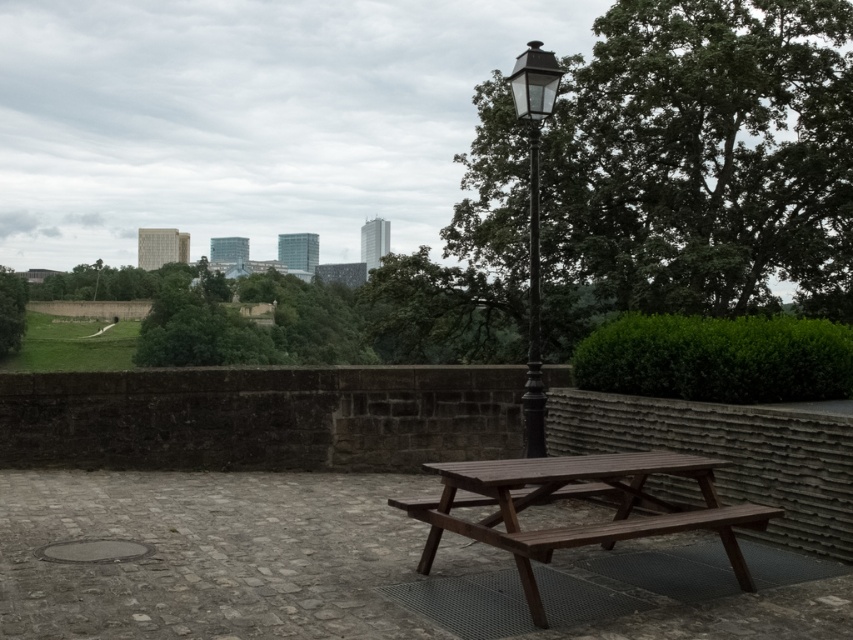
Between brown wooden table at center and black metal lamp post at center, which one is positioned lower?

brown wooden table at center is lower down.

Does brown wooden table at center lie in front of black metal lamp post at center?

Yes, it is in front of black metal lamp post at center.

You are a GUI agent. You are given a task and a screenshot of the screen. Output one action in this format:
    pyautogui.click(x=<x>, y=<y>)
    Task: Click on the brown wooden table at center
    The width and height of the screenshot is (853, 640).
    Given the screenshot: What is the action you would take?
    pyautogui.click(x=577, y=497)

In the scene shown: Is the position of green leafy tree at upper right less distant than that of black metal lamp post at center?

No.

This screenshot has height=640, width=853. What do you see at coordinates (699, 164) in the screenshot?
I see `green leafy tree at upper right` at bounding box center [699, 164].

At what (x,y) coordinates should I click in order to perform the action: click on green leafy tree at upper right. Please return your answer as a coordinate pair (x, y). The height and width of the screenshot is (640, 853). Looking at the image, I should click on (699, 164).

Where is `green leafy tree at upper right`? green leafy tree at upper right is located at coordinates (699, 164).

Can you confirm if green leafy tree at upper right is wider than brown wooden table at center?

Correct, the width of green leafy tree at upper right exceeds that of brown wooden table at center.

Does point (589, 83) lie in front of point (497, 541)?

No.

Does point (743, 125) come behind point (469, 460)?

Yes, it is.

The height and width of the screenshot is (640, 853). Find the location of `green leafy tree at upper right`. green leafy tree at upper right is located at coordinates (699, 164).